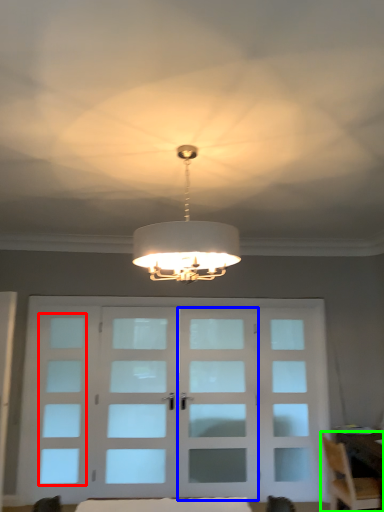
Question: Estimate the real-world distances between objects in this image. Which object is closer to window (highlighted by a red box), screen door (highlighted by a blue box) or chair (highlighted by a green box)?

Choices:
 (A) screen door
 (B) chair

Answer: (A)